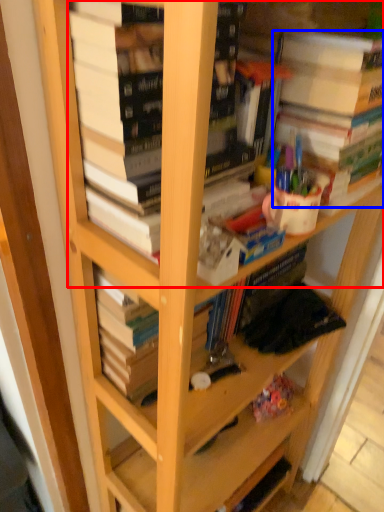
Question: Which object appears closest to the camera in this image, book (highlighted by a red box) or book (highlighted by a blue box)?

Choices:
 (A) book
 (B) book

Answer: (A)